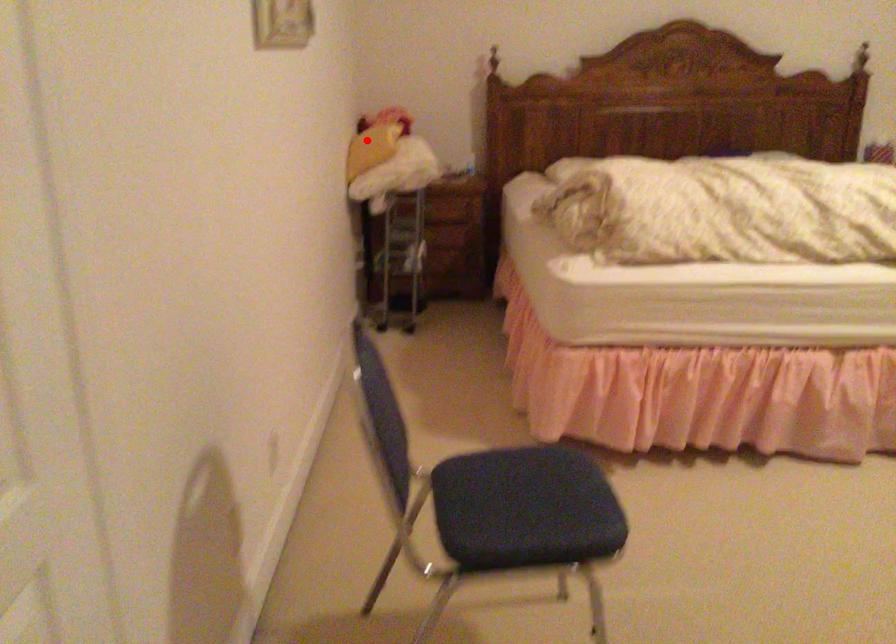
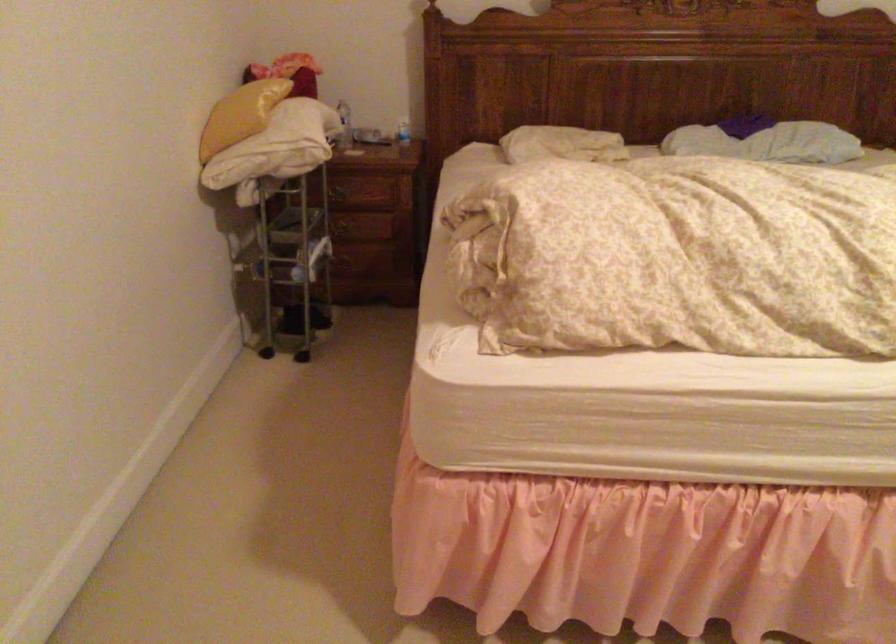
Question: I am providing you with two images of the same scene from different viewpoints. Image1 has a red point marked. In image2, the corresponding 3D location appears at what relative position? Reply with the corresponding letter.

Choices:
 (A) Closer
 (B) Farther

Answer: (A)